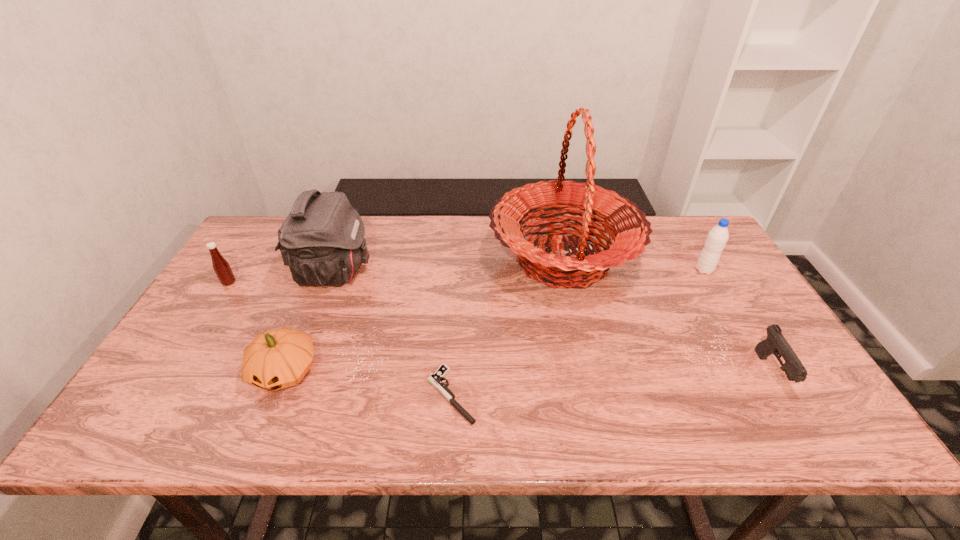
The height and width of the screenshot is (540, 960). What are the coordinates of `free spot located on the right of the third object from right to left` in the screenshot? It's located at (708, 260).

I want to click on vacant space located on the open flap of the shoulder bag, so click(x=401, y=272).

At what (x,y) coordinates should I click in order to perform the action: click on free space located 0.380m on the front of the fifth shortest object. Please return your answer as a coordinate pair (x, y). Looking at the image, I should click on (771, 383).

Where is `vacant space located on the right of the leftmost object`? The height and width of the screenshot is (540, 960). vacant space located on the right of the leftmost object is located at coordinates (295, 283).

Where is `vacant space positioned 0.050m on the side of the gourd with the carved face`? vacant space positioned 0.050m on the side of the gourd with the carved face is located at coordinates (264, 421).

In order to click on vacant space located 0.050m at the barrel of the right pistol in this screenshot , I will do `click(799, 418)`.

Identify the location of vacant space situated 0.100m on the front-facing side of the fourth object from right to left. The width and height of the screenshot is (960, 540). (382, 395).

The height and width of the screenshot is (540, 960). Identify the location of vacant space located on the front-facing side of the fourth object from right to left. (250, 395).

Where is `vacant space situated on the front-facing side of the fourth object from right to left`? Image resolution: width=960 pixels, height=540 pixels. vacant space situated on the front-facing side of the fourth object from right to left is located at coordinates (396, 395).

Locate an element on the screen. This screenshot has width=960, height=540. basket that is positioned at the far edge is located at coordinates (629, 228).